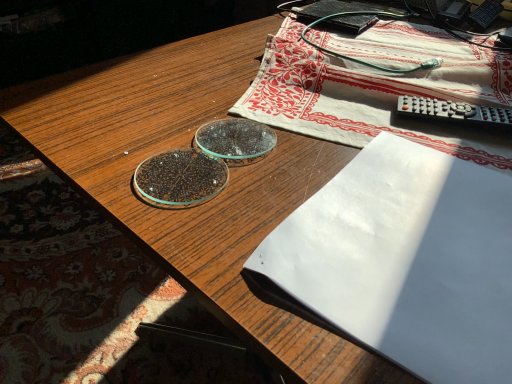
This screenshot has height=384, width=512. Identify the location of vacant space underneath white cotton tablecloth at upper center (from a real-world perspective). (375, 58).